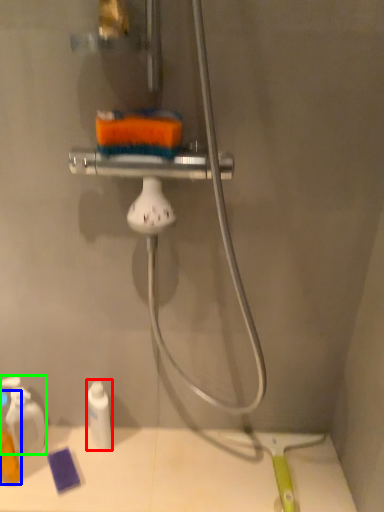
Question: Which object is the closest to the toiletry (highlighted by a red box)? Choose among these: toiletry (highlighted by a blue box) or toiletry (highlighted by a green box).

Choices:
 (A) toiletry
 (B) toiletry

Answer: (B)